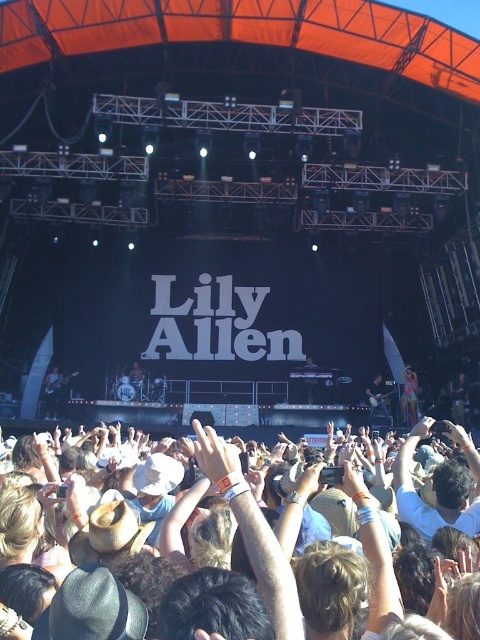
You are a stagehand preparing to adjust the lighting for Lily Allen. You notice the white cloth hands at center and the pink fabric dress at center. Which object should you avoid moving to prevent blocking the spotlight aimed at the dress?

You should avoid moving the white cloth hands at center because they might be wider than the pink fabric dress at center and could block the spotlight if shifted.